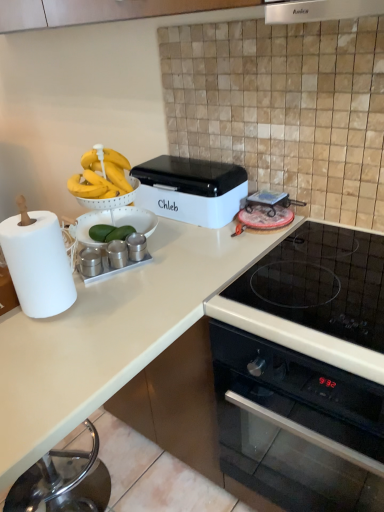
Question: From the image's perspective, relative to white paper at left, is black glass oven at lower right above or below?

Choices:
 (A) below
 (B) above

Answer: (A)

Question: From their relative heights in the image, would you say black glass oven at lower right is taller or shorter than white paper at left?

Choices:
 (A) tall
 (B) short

Answer: (A)

Question: Estimate the real-world distances between objects in this image. Which object is closer to the white plastic bread bin at center?

Choices:
 (A) satin silver exhaust hood at upper center
 (B) satin silver canisters at center
 (C) white matte countertop at lower left
 (D) white paper at left
 (E) black glass oven at lower right

Answer: (C)

Question: Estimate the real-world distances between objects in this image. Which object is farther from the satin silver canisters at center?

Choices:
 (A) satin silver exhaust hood at upper center
 (B) black glass oven at lower right
 (C) white paper at left
 (D) white matte countertop at lower left
 (E) white plastic bread bin at center

Answer: (A)